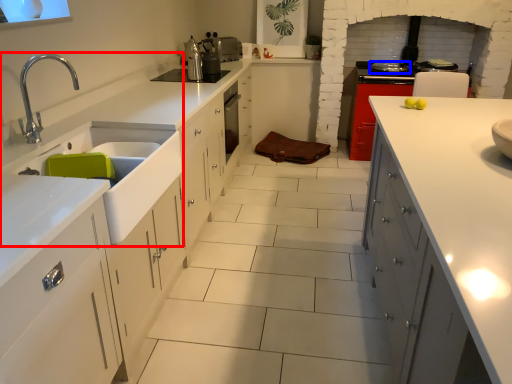
Question: Which point is closer to the camera, sink (highlighted by a red box) or kitchen appliance (highlighted by a blue box)?

Choices:
 (A) sink
 (B) kitchen appliance

Answer: (A)